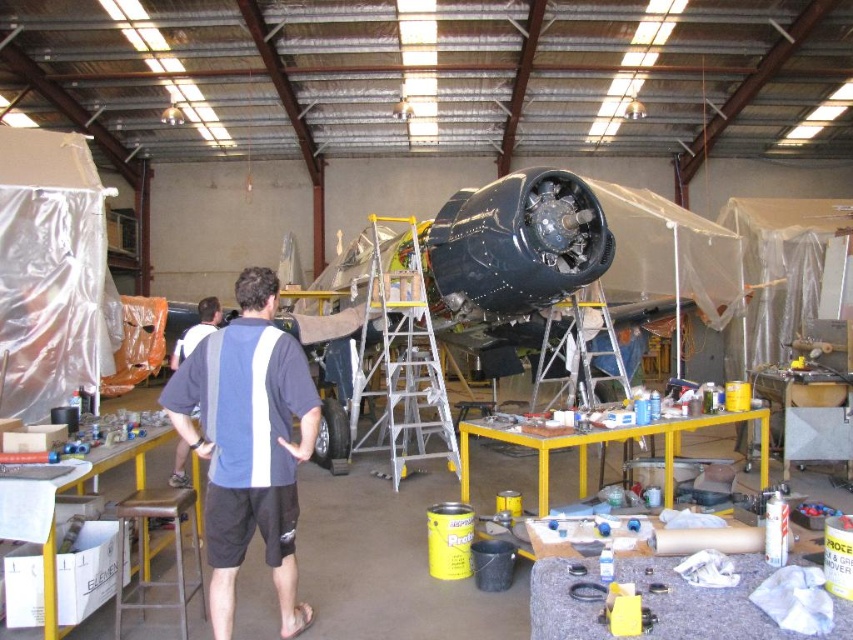
Question: Can you confirm if dark blue t-shirt at center is wider than silver metallic ladder at center?

Choices:
 (A) yes
 (B) no

Answer: (B)

Question: Which point is closer to the camera?

Choices:
 (A) silver/aluminum ladder at center
 (B) white fabric shirt at center
 (C) silver metallic ladder at center
 (D) dark blue t-shirt at center

Answer: (D)

Question: Based on their relative distances, which object is nearer to the dark blue t-shirt at center?

Choices:
 (A) white fabric shirt at center
 (B) silver metallic ladder at center

Answer: (A)

Question: Among these points, which one is nearest to the camera?

Choices:
 (A) (280, 595)
 (B) (178, 458)
 (C) (585, 336)

Answer: (A)

Question: Is dark blue t-shirt at center above white fabric shirt at center?

Choices:
 (A) no
 (B) yes

Answer: (A)

Question: Does silver metallic ladder at center appear over white fabric shirt at center?

Choices:
 (A) no
 (B) yes

Answer: (A)